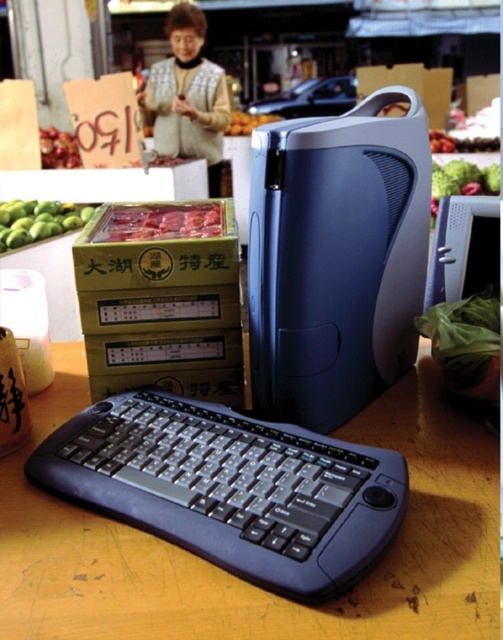
Question: Can you confirm if satin blue desktop at center is positioned to the right of yellow cardboard box at center?

Choices:
 (A) yes
 (B) no

Answer: (A)

Question: Which point appears farthest from the camera in this image?

Choices:
 (A) (214, 84)
 (B) (133, 333)

Answer: (A)

Question: Is the position of black plastic keyboard at lower center less distant than that of green plastic bag at lower right?

Choices:
 (A) yes
 (B) no

Answer: (A)

Question: Is the position of black plastic keyboard at lower center less distant than that of green leafy vegetable at center?

Choices:
 (A) no
 (B) yes

Answer: (B)

Question: Among these points, which one is farthest from the camera?

Choices:
 (A) (212, 173)
 (B) (349, 477)
 (C) (433, 166)

Answer: (A)

Question: Among these objects, which one is nearest to the camera?

Choices:
 (A) yellow cardboard box at center
 (B) green matte apples at left

Answer: (A)